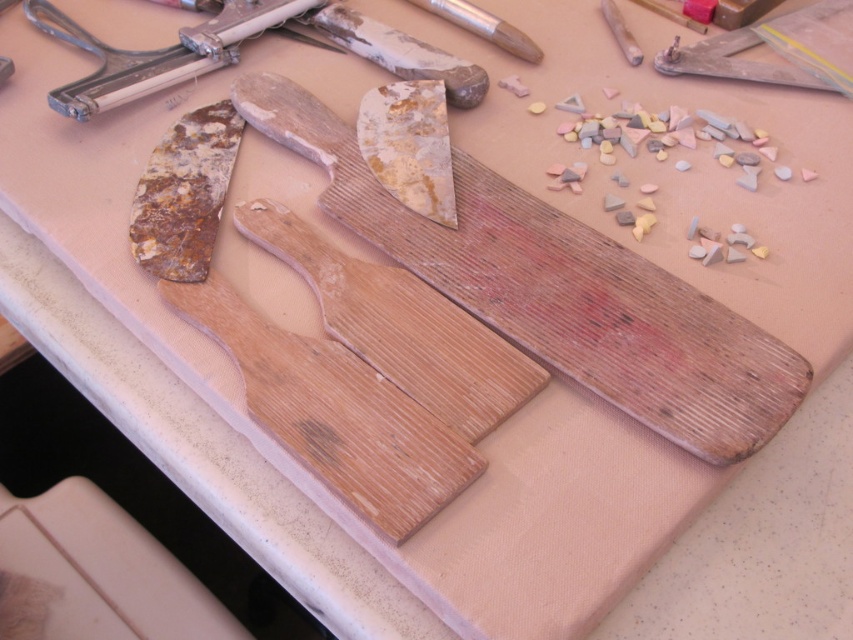
You are organizing tools on a workbench and need to place a new item between the wooden plank at center and the metallic silver tool at upper left. Based on their current positions, which tool should you move to make space?

The wooden plank at center is in front of the metallic silver tool at upper left, so you should move the wooden plank at center to create space between them.

You are organizing a kitchen and need to place the wooden cutting board at center and the metallic silver tool at upper left on a shelf. If the shelf has a width of 30 cm, can both items fit side by side without overlapping?

The wooden cutting board at center might be wider than the metallic silver tool at upper left. Since the shelf is only 30 cm wide, it depends on their exact widths. If the combined width of both items exceeds 30 cm, they won

You are setting up a kitchen counter and need to place both the wooden cutting board at center and the wooden plank at center. Which one should you place first if you want to ensure the taller item is placed first?

You should place the wooden cutting board at center first because it is taller than the wooden plank at center, ensuring the taller item is placed first.